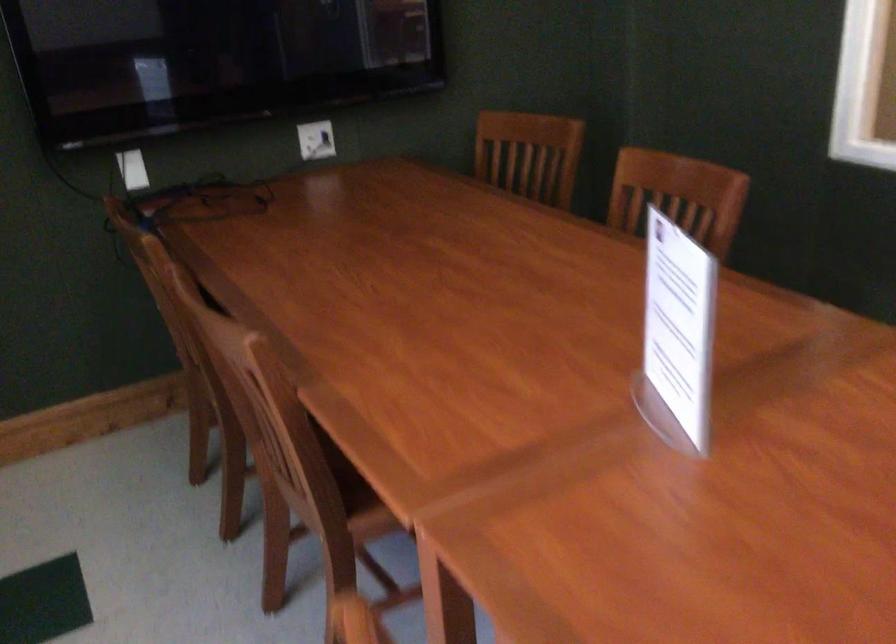
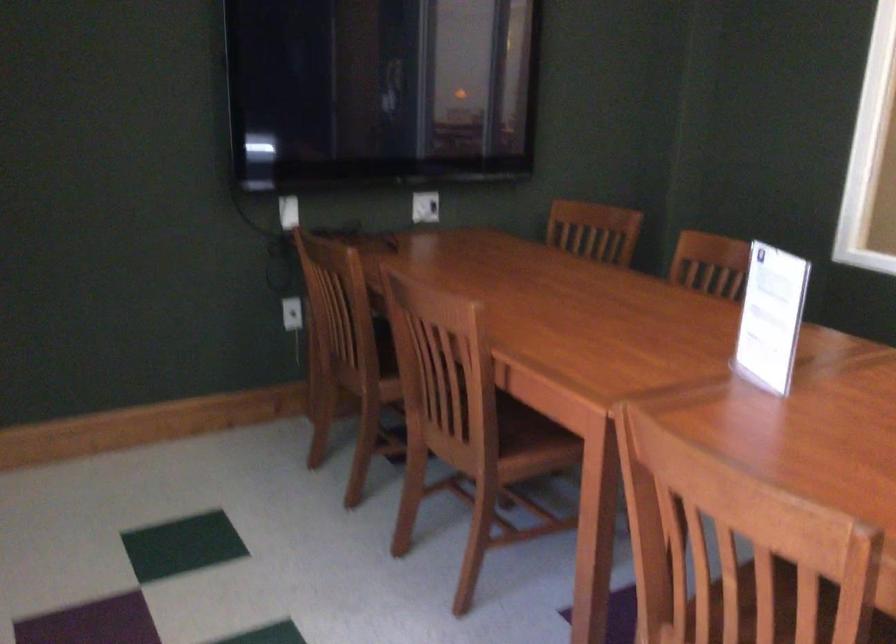
Question: The images are taken continuously from a first-person perspective. In which direction is your viewpoint rotating?

Choices:
 (A) Left
 (B) Right
 (C) Up
 (D) Down

Answer: (C)